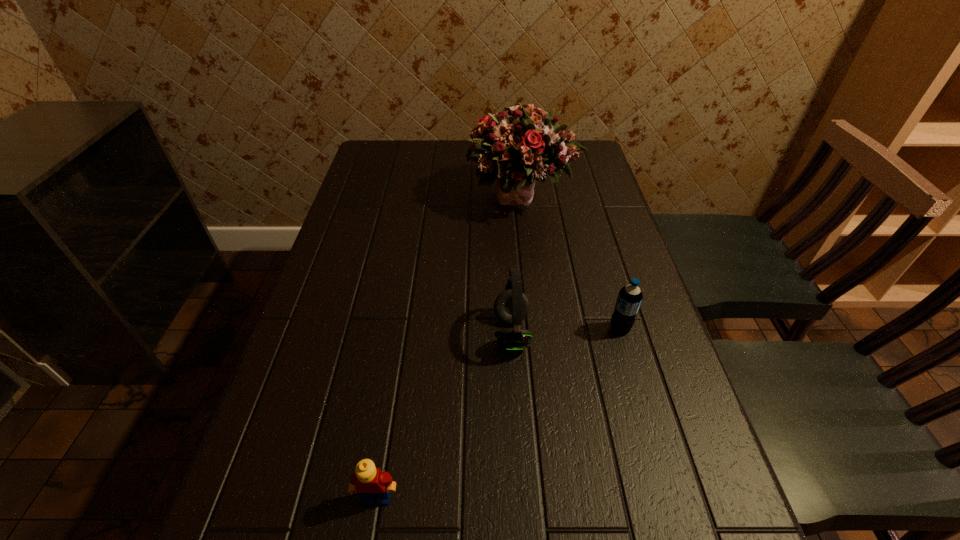
Identify the location of bouquet. The height and width of the screenshot is (540, 960). (521, 144).

At what (x,y) coordinates should I click in order to perform the action: click on the farthest object. Please return your answer as a coordinate pair (x, y). This screenshot has height=540, width=960. Looking at the image, I should click on (521, 144).

Identify the location of headset. The height and width of the screenshot is (540, 960). (511, 306).

Identify the location of soda bottle. click(629, 299).

You are a GUI agent. You are given a task and a screenshot of the screen. Output one action in this format:
    pyautogui.click(x=<x>, y=<y>)
    Task: Click on the shortest object
    The width and height of the screenshot is (960, 540).
    Given the screenshot: What is the action you would take?
    pyautogui.click(x=369, y=482)

Locate an element on the screen. the leftmost object is located at coordinates (369, 482).

The width and height of the screenshot is (960, 540). I want to click on free space located 0.100m on the front of the bouquet, so click(x=529, y=253).

This screenshot has width=960, height=540. I want to click on free space located on the ear cups of the headset, so click(341, 333).

You are a GUI agent. You are given a task and a screenshot of the screen. Output one action in this format:
    pyautogui.click(x=<x>, y=<y>)
    Task: Click on the blank space located 0.310m on the ear cups of the headset
    The height and width of the screenshot is (540, 960).
    Given the screenshot: What is the action you would take?
    tap(350, 333)

The image size is (960, 540). In order to click on vacant space located on the ear cups of the headset in this screenshot , I will do `click(336, 333)`.